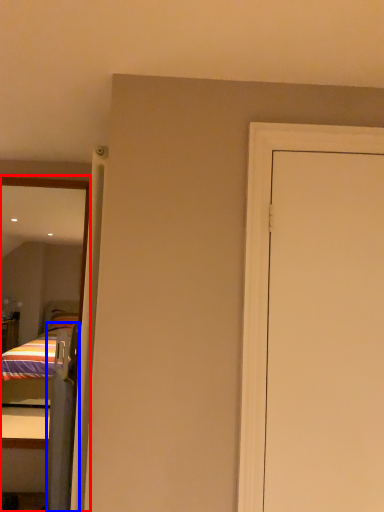
Question: Which object is closer to the camera taking this photo, mirror (highlighted by a red box) or screen door (highlighted by a blue box)?

Choices:
 (A) mirror
 (B) screen door

Answer: (B)